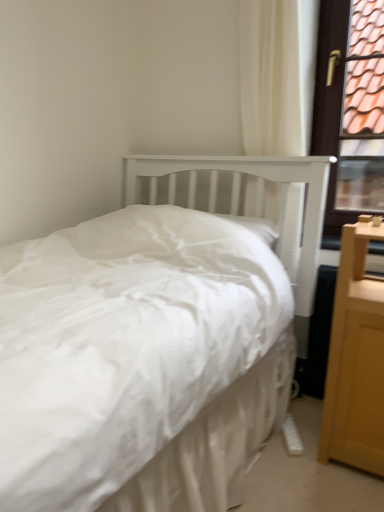
This screenshot has width=384, height=512. Describe the element at coordinates (350, 108) in the screenshot. I see `brown wooden window frame at upper right` at that location.

In order to click on brown wooden window frame at upper right in this screenshot , I will do `click(350, 108)`.

The height and width of the screenshot is (512, 384). What are the coordinates of `light wood nightstand at right` in the screenshot? It's located at (355, 360).

What do you see at coordinates (355, 360) in the screenshot?
I see `light wood nightstand at right` at bounding box center [355, 360].

Identify the location of brown wooden window frame at upper right. Image resolution: width=384 pixels, height=512 pixels. (350, 108).

Considering the relative positions of light wood nightstand at right and brown wooden window frame at upper right in the image provided, is light wood nightstand at right to the left of brown wooden window frame at upper right from the viewer's perspective?

Correct, you'll find light wood nightstand at right to the left of brown wooden window frame at upper right.

Which object is more forward, light wood nightstand at right or brown wooden window frame at upper right?

light wood nightstand at right.

Does point (369, 230) come in front of point (330, 17)?

Yes, it is in front of point (330, 17).

From the image's perspective, is light wood nightstand at right above brown wooden window frame at upper right?

No.

From a real-world perspective, which is physically below, light wood nightstand at right or brown wooden window frame at upper right?

In real-world perspective, light wood nightstand at right is lower.

Which object is wider, light wood nightstand at right or brown wooden window frame at upper right?

light wood nightstand at right.

Who is taller, light wood nightstand at right or brown wooden window frame at upper right?

brown wooden window frame at upper right is taller.

Between light wood nightstand at right and brown wooden window frame at upper right, which one has smaller size?

brown wooden window frame at upper right.

Is light wood nightstand at right completely or partially outside of brown wooden window frame at upper right?

That's correct, light wood nightstand at right is outside of brown wooden window frame at upper right.

Is light wood nightstand at right beside brown wooden window frame at upper right?

No, light wood nightstand at right is not touching brown wooden window frame at upper right.

Could you tell me if light wood nightstand at right is facing brown wooden window frame at upper right?

No, light wood nightstand at right does not turn towards brown wooden window frame at upper right.

In the image, there is a brown wooden window frame at upper right. In order to click on nightstand below it (from the image's perspective) in this screenshot , I will do `click(355, 360)`.

Based on their positions, is brown wooden window frame at upper right located to the left or right of light wood nightstand at right?

From the image, it's evident that brown wooden window frame at upper right is to the right of light wood nightstand at right.

Between brown wooden window frame at upper right and light wood nightstand at right, which one is positioned behind?

brown wooden window frame at upper right.

Which is more distant, (367, 74) or (327, 391)?

The point (367, 74) is farther from the camera.

From the image's perspective, which object appears higher, brown wooden window frame at upper right or light wood nightstand at right?

brown wooden window frame at upper right.

From a real-world perspective, is brown wooden window frame at upper right on top of light wood nightstand at right?

Indeed, from a real-world perspective, brown wooden window frame at upper right stands above light wood nightstand at right.

Which object is wider, brown wooden window frame at upper right or light wood nightstand at right?

light wood nightstand at right is wider.

Which of these two, brown wooden window frame at upper right or light wood nightstand at right, stands taller?

Standing taller between the two is brown wooden window frame at upper right.

Who is bigger, brown wooden window frame at upper right or light wood nightstand at right?

light wood nightstand at right is bigger.

From the picture: Is light wood nightstand at right a part of brown wooden window frame at upper right?

No.

Is brown wooden window frame at upper right directly adjacent to light wood nightstand at right?

No, brown wooden window frame at upper right is not next to light wood nightstand at right.

Is brown wooden window frame at upper right oriented away from light wood nightstand at right?

No, light wood nightstand at right is not at the back of brown wooden window frame at upper right.

Image resolution: width=384 pixels, height=512 pixels. In order to click on nightstand that appears below the brown wooden window frame at upper right (from the image's perspective) in this screenshot , I will do `click(355, 360)`.

At what (x,y) coordinates should I click in order to perform the action: click on window frame located above the light wood nightstand at right (from the image's perspective). Please return your answer as a coordinate pair (x, y). The width and height of the screenshot is (384, 512). Looking at the image, I should click on (350, 108).

Locate an element on the screen. window frame on the right of light wood nightstand at right is located at coordinates (350, 108).